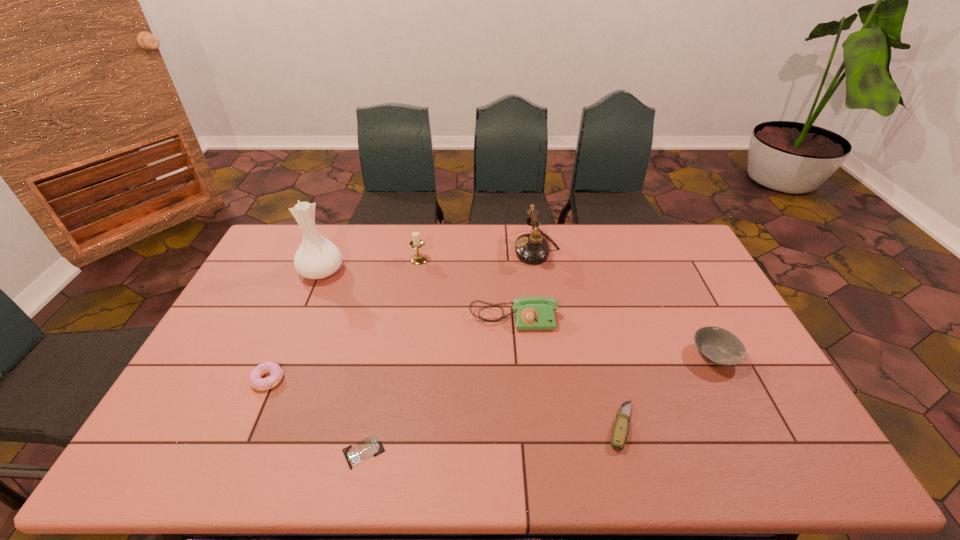
This screenshot has width=960, height=540. I want to click on free point located on the left of the seventh object from left to right, so click(490, 427).

Locate an element on the screen. Image resolution: width=960 pixels, height=540 pixels. vacant area located 0.220m on the left of the shortest object is located at coordinates (250, 452).

The height and width of the screenshot is (540, 960). Identify the location of vase positioned at the far edge. (317, 258).

The width and height of the screenshot is (960, 540). In order to click on telephone that is at the far edge in this screenshot , I will do `click(532, 248)`.

Image resolution: width=960 pixels, height=540 pixels. I want to click on candle holder present at the far edge, so point(416,243).

This screenshot has height=540, width=960. What are the coordinates of `pocketknife situated at the near edge` in the screenshot? It's located at (619, 435).

Locate an element on the screen. The image size is (960, 540). identity card located in the near edge section of the desktop is located at coordinates (371, 446).

Where is `object at the left edge`? object at the left edge is located at coordinates (317, 258).

What are the coordinates of `object located at the right edge` in the screenshot? It's located at (718, 346).

The width and height of the screenshot is (960, 540). What are the coordinates of `object present at the far left corner` in the screenshot? It's located at (317, 258).